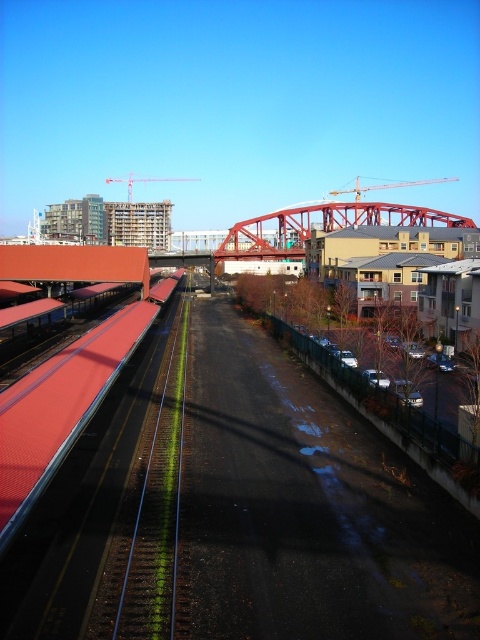
You are a photographer standing at the railway track center. You want to take a photo of both point [230,228] and point [164,179]. Which point should you focus on first to ensure both are in sharp focus?

You should focus on point [230,228] first because it is closer to the camera than point [164,179]. This ensures the closer point is in focus, and the farther point will also be within the depth of field.